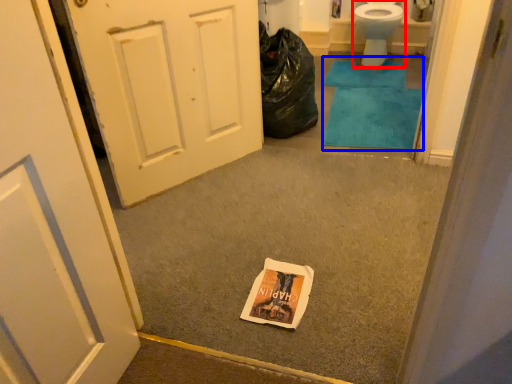
Question: Among these objects, which one is nearest to the camera, toilet (highlighted by a red box) or bath mat (highlighted by a blue box)?

Choices:
 (A) toilet
 (B) bath mat

Answer: (B)